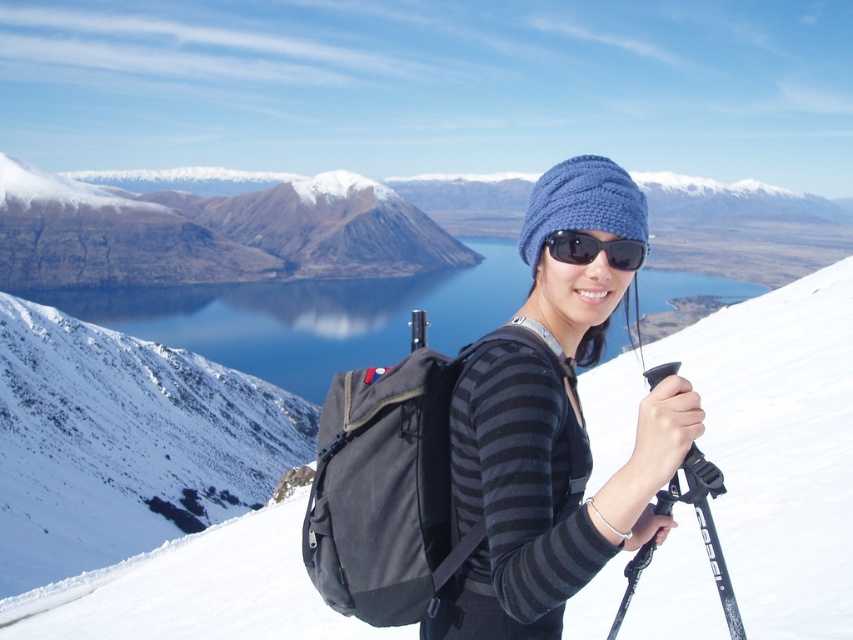
You are planning to carry a new item in your backpack. Given that the matte black backpack at center is wider than the blue knitted hat at center, can the backpack accommodate the hat without removing any items?

The matte black backpack at center is wider than the blue knitted hat at center, so the backpack can accommodate the hat without removing any items since its width is sufficient.

You are planning to take a photo of the blue water at center and the black reflective sunglasses at center. Which object should you focus on first if you want to capture both in the same frame without moving the camera?

The blue water at center is larger in size than the black reflective sunglasses at center, so you should focus on the blue water at center first to ensure it fits properly in the frame.

From the picture: You are a photographer planning to take a portrait of the person in the scene. You want to ensure that both the knitted blue hat at center and the black plastic ski pole at lower right are visible in the frame. Based on their sizes, which object should you focus on to ensure both are in focus?

The knitted blue hat at center is taller than the black plastic ski pole at lower right, so focusing on the knitted blue hat at center would ensure both are in focus since it is larger and closer to the camera.